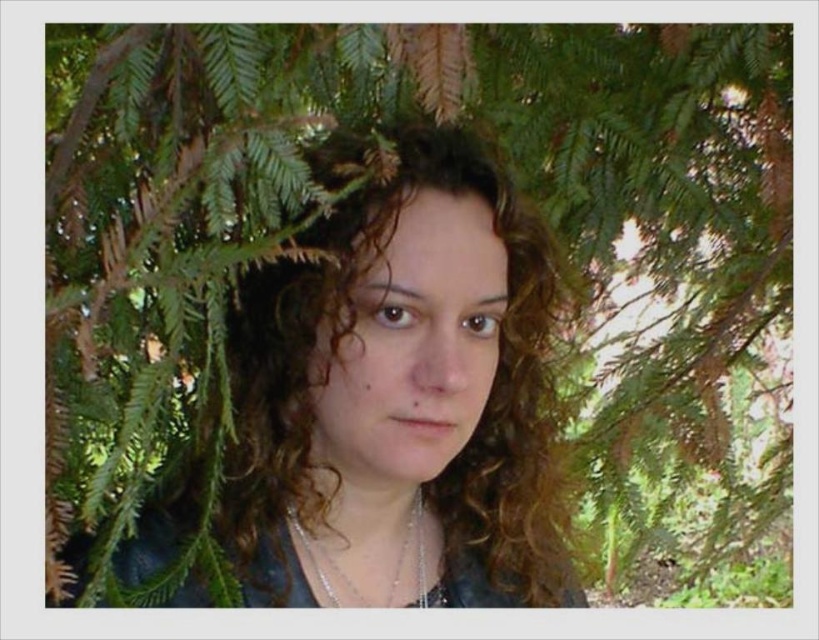
Question: Is curly hair at center to the right of silver metallic necklace at center from the viewer's perspective?

Choices:
 (A) yes
 (B) no

Answer: (A)

Question: Is curly hair at center above silver metallic necklace at center?

Choices:
 (A) no
 (B) yes

Answer: (B)

Question: Does curly hair at center appear on the left side of silver metallic necklace at center?

Choices:
 (A) yes
 (B) no

Answer: (B)